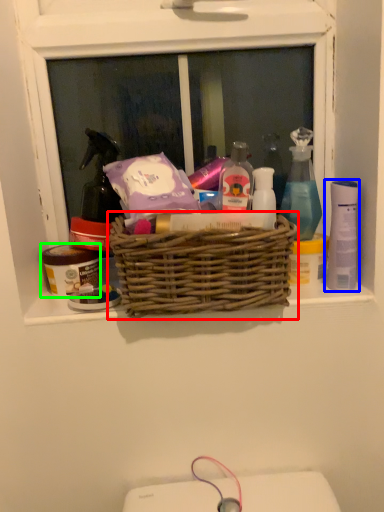
Question: Which object is positioned farthest from picnic basket (highlighted by a red box)? Select from mouthwash (highlighted by a blue box) and toiletry (highlighted by a green box).

Choices:
 (A) mouthwash
 (B) toiletry

Answer: (A)